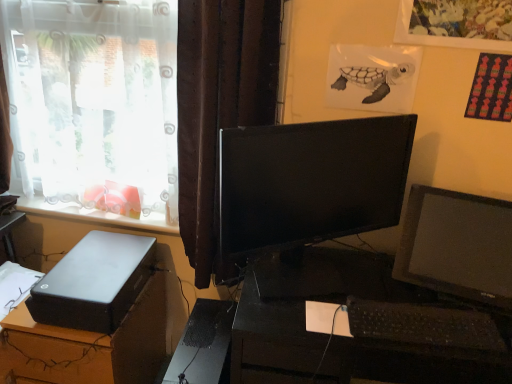
Where is `vacant space in black glossy monitor at center (from a real-world perspective)`? This screenshot has height=384, width=512. vacant space in black glossy monitor at center (from a real-world perspective) is located at coordinates (297, 284).